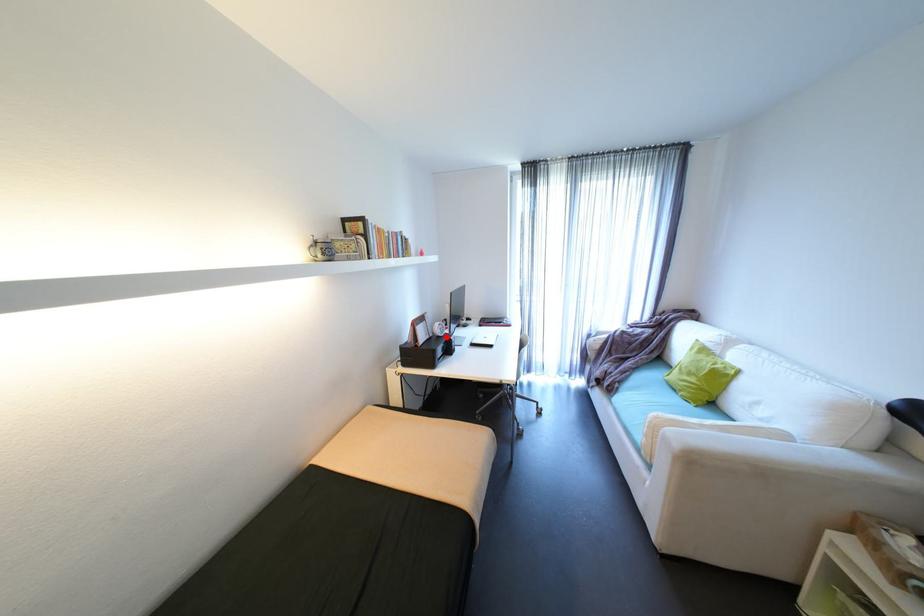
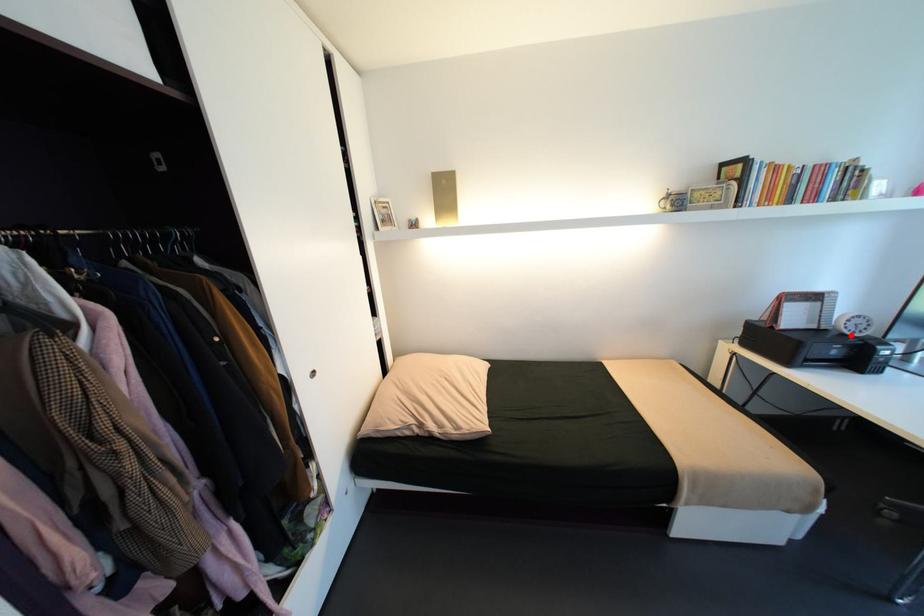
I am providing you with two images of the same scene from different viewpoints. A red point is marked on the first image and another point is marked on the second image. Does the point marked in image1 correspond to the same location as the one in image2?

Yes